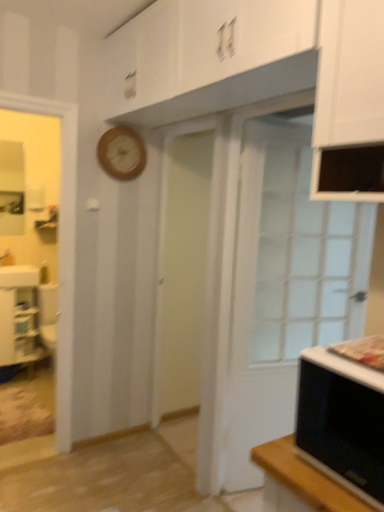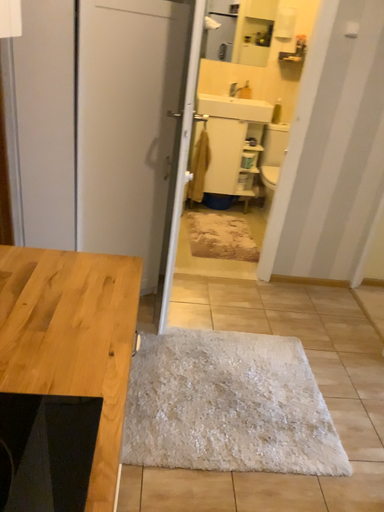
Question: How did the camera likely rotate when shooting the video?

Choices:
 (A) rotated left
 (B) rotated right

Answer: (A)